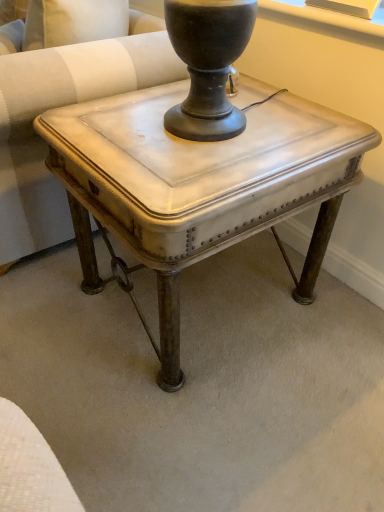
Question: In the image, is white painted wood table at center positioned in front of or behind white leather swivel chair at center?

Choices:
 (A) behind
 (B) front

Answer: (B)

Question: From a real-world perspective, is white painted wood table at center above or below white leather swivel chair at center?

Choices:
 (A) above
 (B) below

Answer: (B)

Question: In terms of width, does white painted wood table at center look wider or thinner when compared to white leather swivel chair at center?

Choices:
 (A) thin
 (B) wide

Answer: (A)

Question: Is point (11, 58) closer or farther from the camera than point (77, 133)?

Choices:
 (A) farther
 (B) closer

Answer: (A)

Question: Is white leather swivel chair at center inside the boundaries of white painted wood table at center, or outside?

Choices:
 (A) inside
 (B) outside

Answer: (B)

Question: Looking at their shapes, would you say white leather swivel chair at center is wider or thinner than white painted wood table at center?

Choices:
 (A) thin
 (B) wide

Answer: (B)

Question: In terms of height, does white leather swivel chair at center look taller or shorter compared to white painted wood table at center?

Choices:
 (A) short
 (B) tall

Answer: (B)